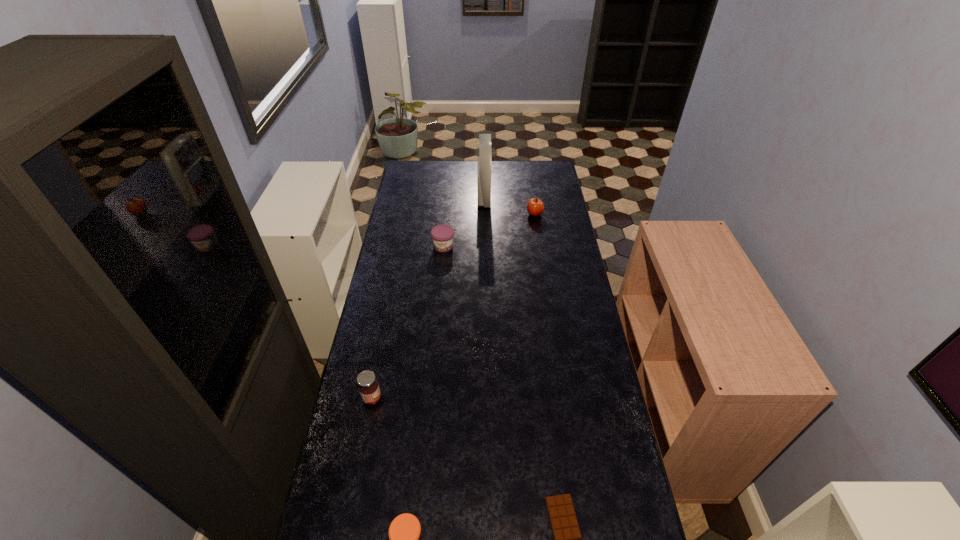
Find the location of `the tallest object`. the tallest object is located at coordinates (485, 153).

The height and width of the screenshot is (540, 960). In order to click on the first-aid kit in this screenshot , I will do `click(485, 153)`.

Identify the location of the leftmost object. (368, 387).

Find the location of `the leftmost jam`. the leftmost jam is located at coordinates (368, 387).

Find the location of `apple`. apple is located at coordinates (535, 206).

Locate an element on the screen. This screenshot has height=540, width=960. the third shortest object is located at coordinates (442, 236).

Locate an element on the screen. The width and height of the screenshot is (960, 540). the fourth nearest object is located at coordinates (442, 236).

What are the coordinates of `free space located 0.120m on the front-facing side of the tallest object` in the screenshot? It's located at (454, 198).

Where is `vacant space located 0.320m on the front-facing side of the tallest object`? vacant space located 0.320m on the front-facing side of the tallest object is located at coordinates (416, 198).

Where is `vacant space located 0.270m on the front-facing side of the tallest object`? This screenshot has height=540, width=960. vacant space located 0.270m on the front-facing side of the tallest object is located at coordinates 425,198.